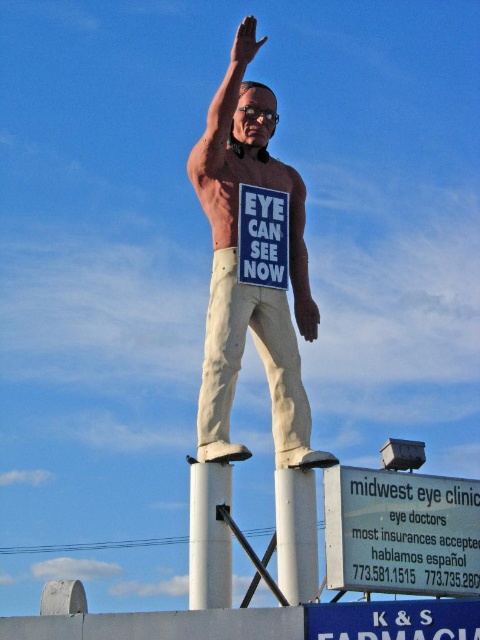
You are standing in front of the statue and want to read both the white plastic sign at lower right and the white matte signboard at center. Which one is located to the right side of the other?

The white plastic sign at lower right is located to the right of the white matte signboard at center.

You are a maintenance worker needing to replace a light fixture between the white painted metal pole at center and the white smooth pole at lower center. The light fixture requires a minimum of 4 meters of space to be installed safely. Based on the image, can you proceed with the installation?

The distance between the white painted metal pole at center and the white smooth pole at lower center is 3.94 meters, which is slightly less than the required 4 meters. Therefore, you cannot proceed with the installation safely.